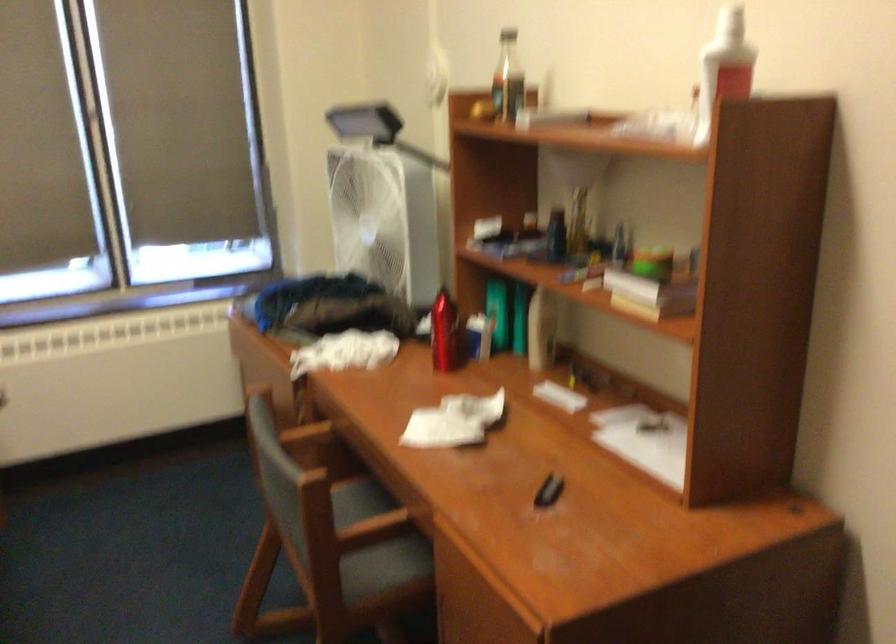
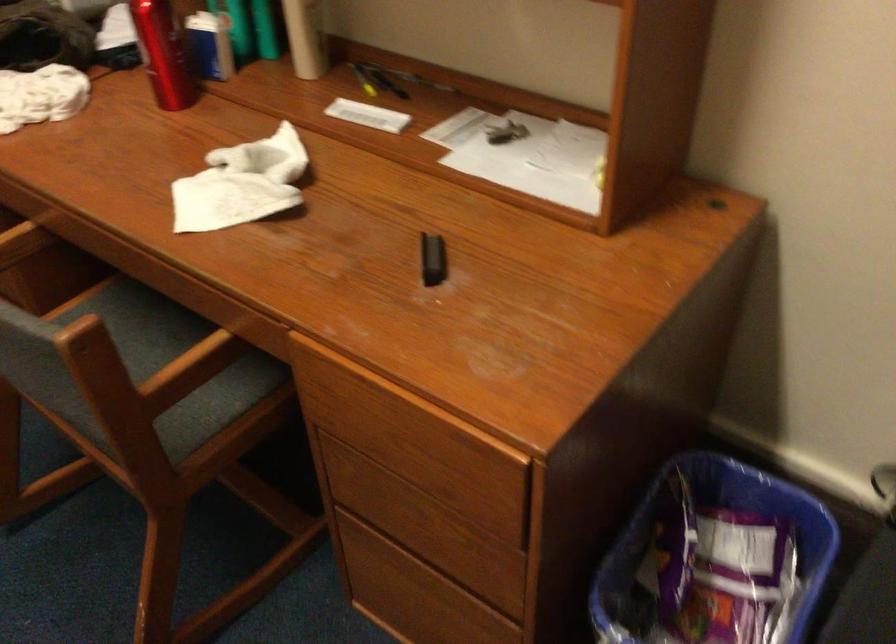
Find the pixel in the second image that matches (442,335) in the first image.

(162, 53)